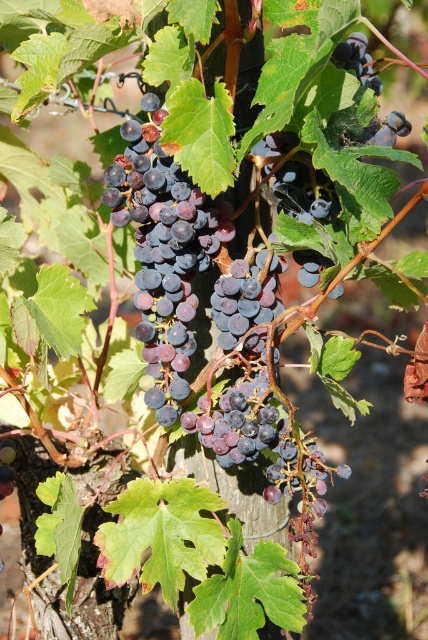
You are a fruit picker observing the grape cluster. Which of the two grapes, the dark purple grapes at center or the shiny purple grapes at center, is positioned higher on the vine?

The dark purple grapes at center is located above the shiny purple grapes at center, so it is positioned higher on the vine.

You are a photographer trying to focus on the grapes in the image. You notice two points marked in the scene. Which point is closer to your camera lens, point 1 at coordinates point (146, 371) or point 2 at coordinates point (5, 442)?

Point (146, 371) is closer to the camera than point (5, 442).